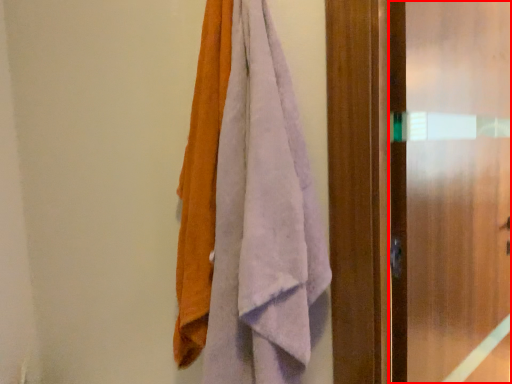
Question: In this image, where is screen door (annotated by the red box) located relative to towel?

Choices:
 (A) left
 (B) right

Answer: (B)